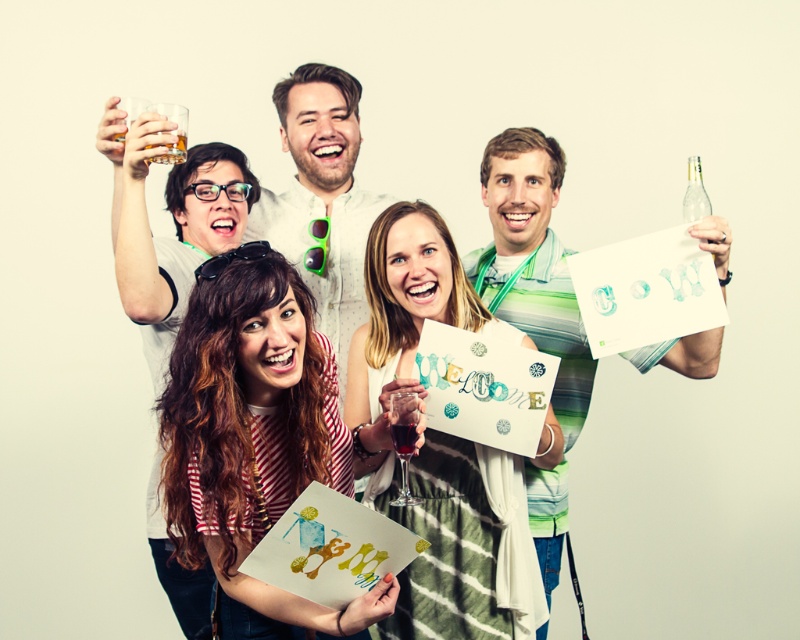
You are a photographer adjusting the camera focus. You want to ensure both the matte white shirt at center and the clear glass bottle at upper right are in focus. Which object should you focus on first to achieve this?

You should focus on the matte white shirt at center first because it is closer to the viewer than the clear glass bottle at upper right. By focusing on the closer object, the depth of field will extend to include the farther object in focus as well.

You are a photographer adjusting your camera settings. You notice the translucent glass at upper left and the dark red liquid at center. Which object should you focus on first to ensure it appears sharp in the photo?

The translucent glass at upper left is closer to you than the dark red liquid at center, so focusing on the translucent glass at upper left first will ensure it appears sharp. You can then adjust for the dark red liquid at center if needed.